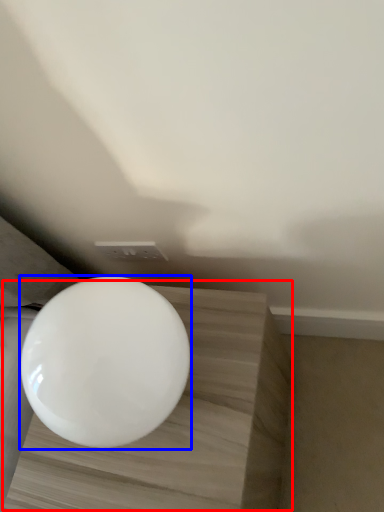
Question: Among these objects, which one is nearest to the camera, table (highlighted by a red box) or toilet (highlighted by a blue box)?

Choices:
 (A) table
 (B) toilet

Answer: (B)